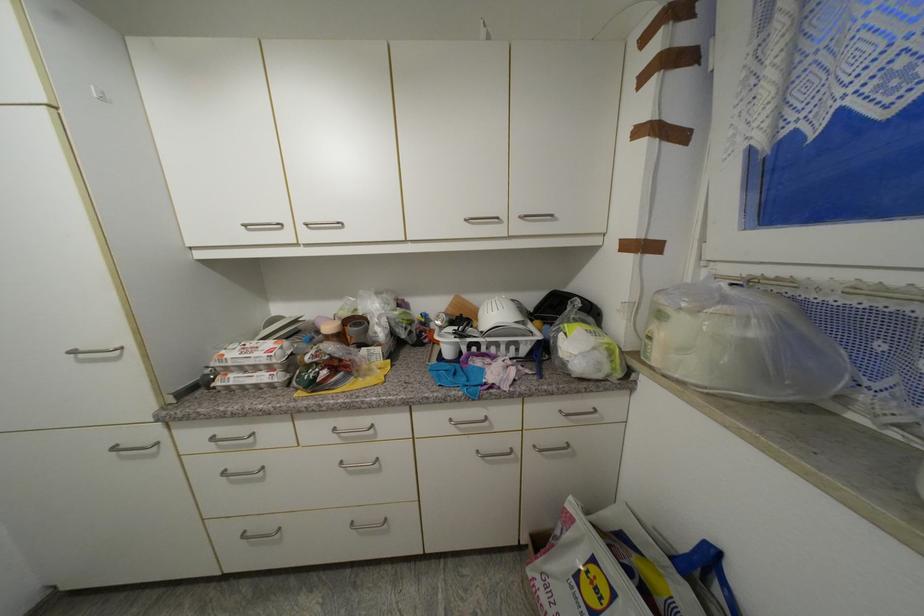
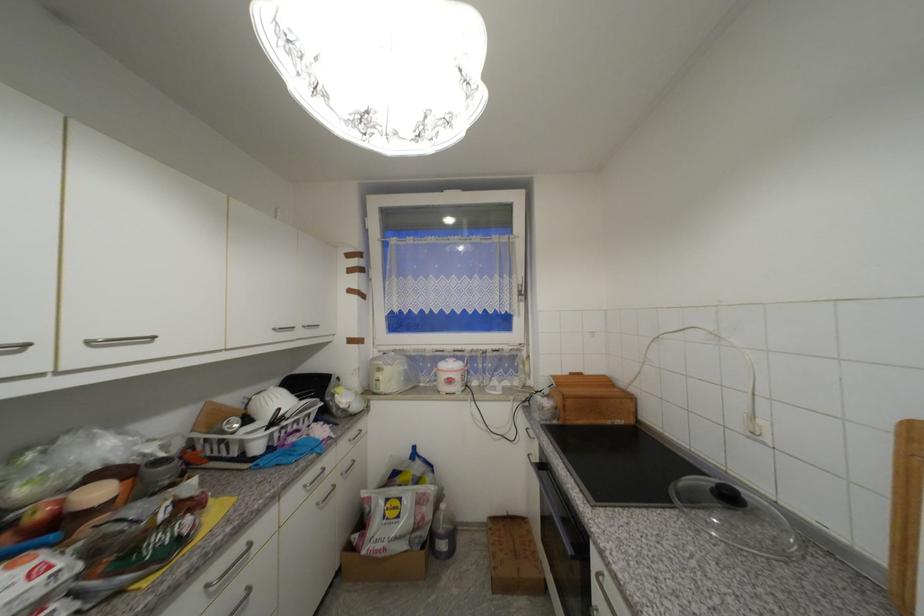
The point at (456, 422) is marked in the first image. Where is the corresponding point in the second image?

(310, 488)